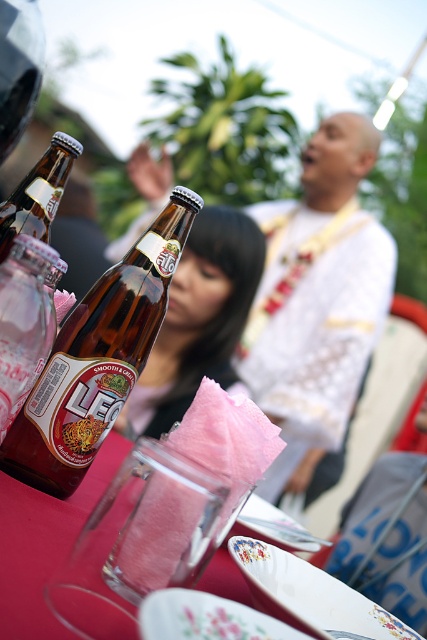
Can you confirm if matte black hair at center is shorter than porcelain plate at center?

No, matte black hair at center is not shorter than porcelain plate at center.

Which is behind, point (207, 209) or point (365, 611)?

The point (207, 209) is more distant.

Which is in front, point (245, 266) or point (253, 593)?

Point (253, 593) is in front.

The image size is (427, 640). In order to click on matte black hair at center in this screenshot , I will do `click(199, 317)`.

Between brown glass bottle at center and matte black hair at center, which one appears on the right side from the viewer's perspective?

From the viewer's perspective, matte black hair at center appears more on the right side.

Does brown glass bottle at center have a greater height compared to matte black hair at center?

In fact, brown glass bottle at center may be shorter than matte black hair at center.

Between point (78, 400) and point (195, 317), which one is positioned behind?

Positioned behind is point (195, 317).

The height and width of the screenshot is (640, 427). I want to click on brown glass bottle at center, so coord(98,358).

Does porcelain floral plate at center have a lesser width compared to brown glass bottle at left?

Indeed, porcelain floral plate at center has a lesser width compared to brown glass bottle at left.

Between point (175, 636) and point (23, 200), which one is positioned in front?

Point (175, 636)

Locate an element on the screen. porcelain floral plate at center is located at coordinates (207, 618).